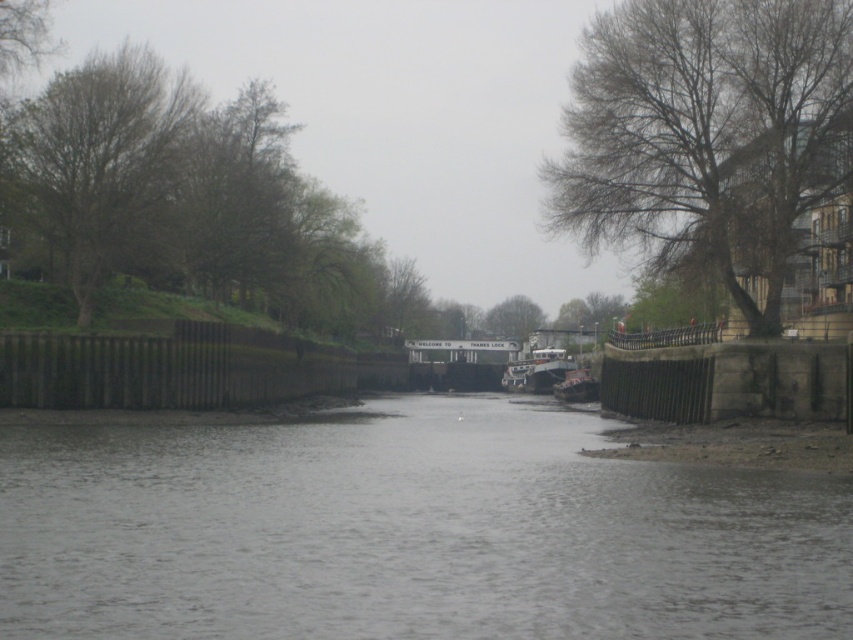
You are standing at the origin point of the image. Which direction should you move to reach the gray concrete river at center?

The gray concrete river at center is located at point 0.833 on the x axis and 0.479 on the y axis, so you should move towards the right and slightly upwards to reach it.

You are a boat operator who needs to navigate a narrow channel. You see the gray concrete river at center and the metallic gray barge at center. Which one has a wider passage for your boat?

The gray concrete river at center has a wider passage than the metallic gray barge at center because its width is larger, as stated in the objects description.

You are a boat operator who needs to navigate a new metallic gray barge at center through the gray concrete river at center. Based on the scene description, can the barge fit through the river in terms of length?

The gray concrete river at center is shorter than the metallic gray barge at center, so the barge cannot fit through the river in terms of length.